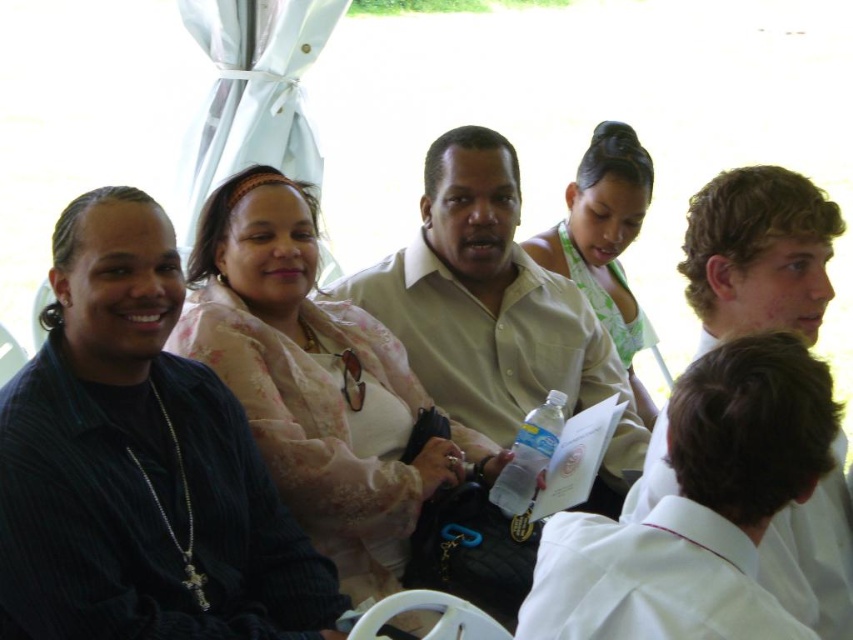
You are a photographer trying to capture a group photo of the people under the white canopy. You notice the floral lace blouse at center and the white cotton shirt at lower right. Which clothing item should you focus on if you want to highlight something larger in size?

The floral lace blouse at center is larger in size compared to the white cotton shirt at lower right, so focusing on the floral lace blouse at center would highlight the larger clothing item.